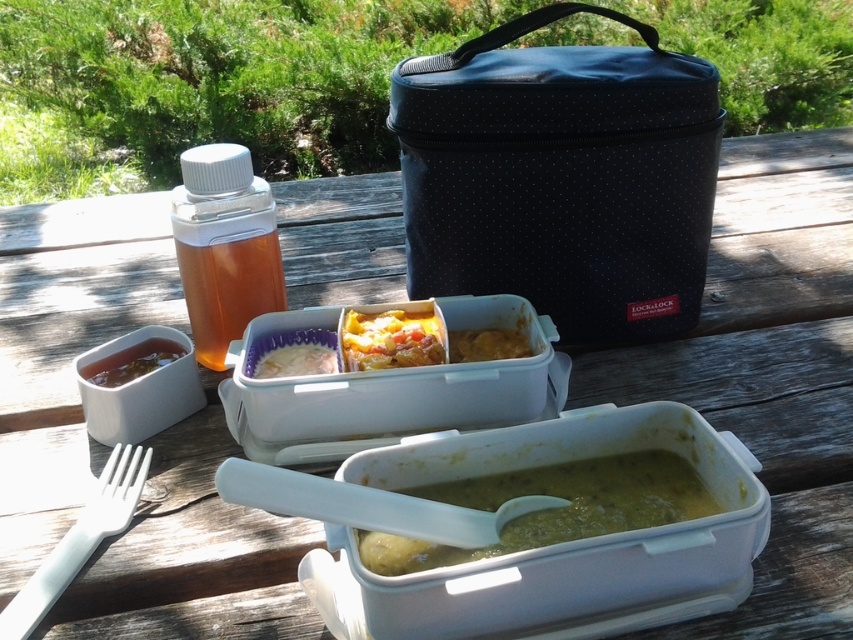
Is point (218, 225) behind point (361, 333)?

Yes, point (218, 225) is behind point (361, 333).

I want to click on translucent plastic bottle at upper left, so click(224, 246).

Who is lower down, translucent plastic bottle at upper left or white creamy rice at center?

white creamy rice at center is below.

Is translucent plastic bottle at upper left below white creamy rice at center?

No, translucent plastic bottle at upper left is not below white creamy rice at center.

Which is behind, point (173, 236) or point (312, 369)?

The point (173, 236) is more distant.

At what (x,y) coordinates should I click in order to perform the action: click on translucent plastic bottle at upper left. Please return your answer as a coordinate pair (x, y). Image resolution: width=853 pixels, height=640 pixels. Looking at the image, I should click on (224, 246).

Which is behind, point (561, 468) or point (170, 348)?

The point (170, 348) is more distant.

Who is more forward, [490,481] or [129,380]?

Point [490,481] is more forward.

Describe the element at coordinates (553, 508) in the screenshot. I see `green matte soup at lower center` at that location.

Identify the location of green matte soup at lower center. tap(553, 508).